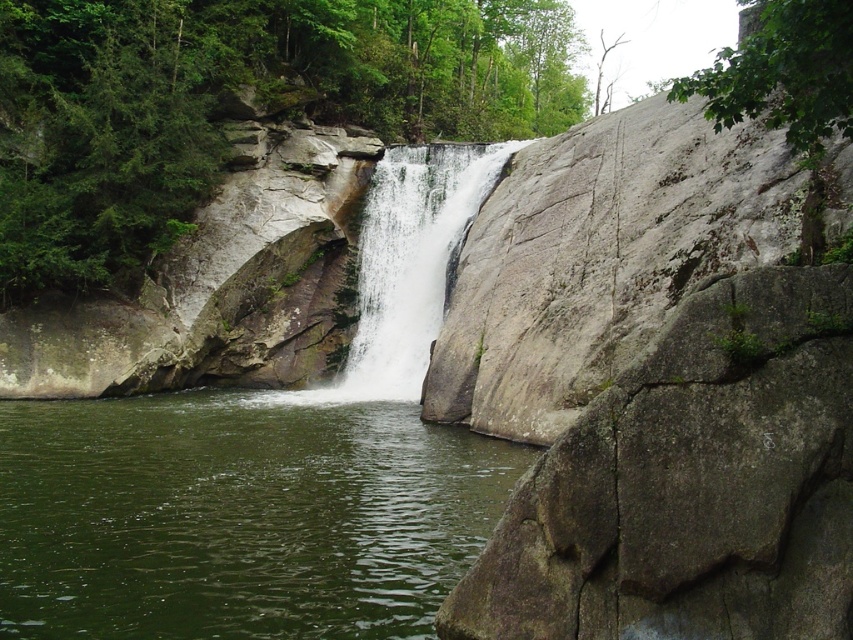
Question: Which of the following is the closest to the observer?

Choices:
 (A) click(x=346, y=522)
 (B) click(x=436, y=333)
 (C) click(x=634, y=451)

Answer: (C)

Question: Can you confirm if gray rough rock at right is smaller than white smooth waterfall at center?

Choices:
 (A) yes
 (B) no

Answer: (A)

Question: Is gray rough rock at right wider than white smooth waterfall at center?

Choices:
 (A) no
 (B) yes

Answer: (A)

Question: Which point is closer to the camera?

Choices:
 (A) (425, 189)
 (B) (589, 472)
 (C) (236, 515)

Answer: (B)

Question: Which point is closer to the camera?

Choices:
 (A) green liquid water at center
 (B) white smooth waterfall at center
 (C) gray rough rock at right

Answer: (C)

Question: Does green liquid water at center have a greater width compared to white smooth waterfall at center?

Choices:
 (A) no
 (B) yes

Answer: (B)